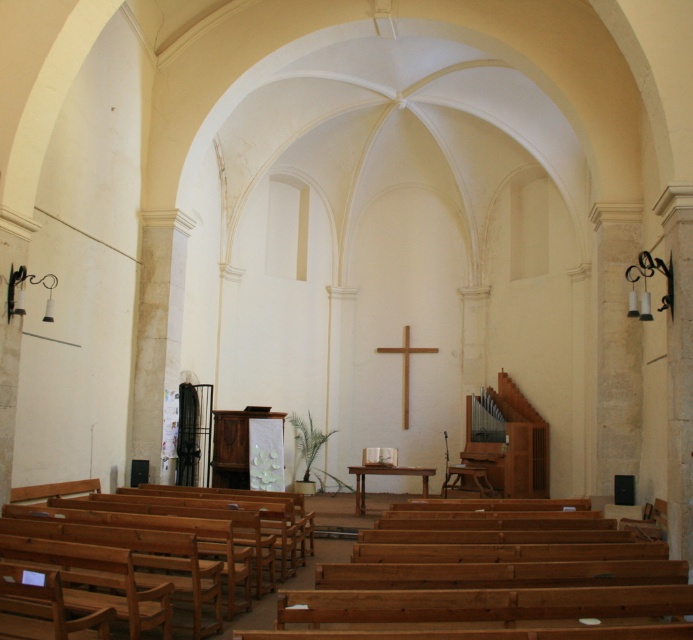
Question: From the image, what is the correct spatial relationship of natural wood church bench at lower left in relation to wooden cross at center?

Choices:
 (A) above
 (B) below

Answer: (B)

Question: Does natural wood church bench at lower left come behind wooden polished table at center?

Choices:
 (A) yes
 (B) no

Answer: (B)

Question: Is natural wood church bench at lower left wider than wooden cross at center?

Choices:
 (A) no
 (B) yes

Answer: (B)

Question: Among these points, which one is nearest to the camera?

Choices:
 (A) (435, 352)
 (B) (116, 516)

Answer: (B)

Question: Among these points, which one is farthest from the camera?

Choices:
 (A) (245, 545)
 (B) (374, 468)
 (C) (403, 401)

Answer: (C)

Question: Among these points, which one is farthest from the camera?

Choices:
 (A) [x=428, y=348]
 (B) [x=377, y=468]

Answer: (A)